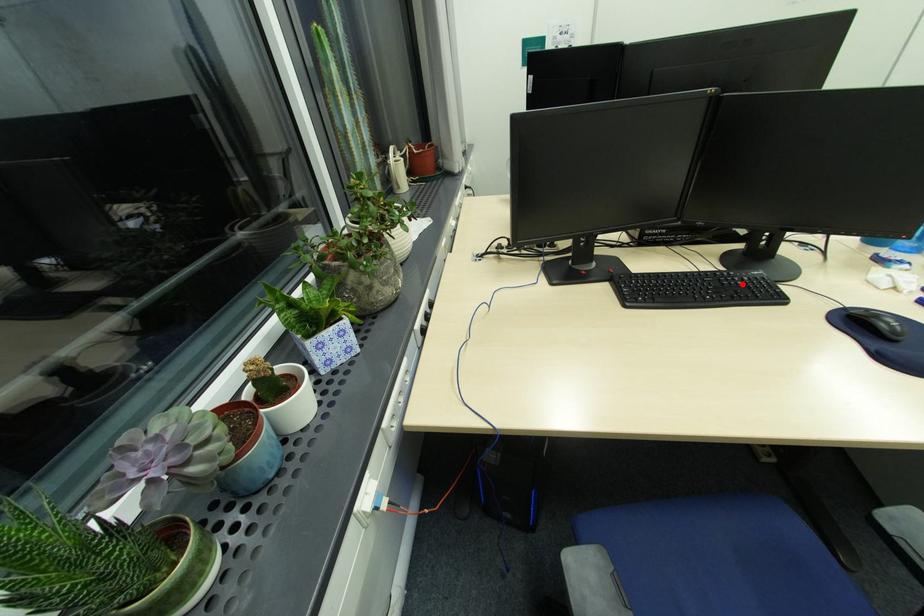
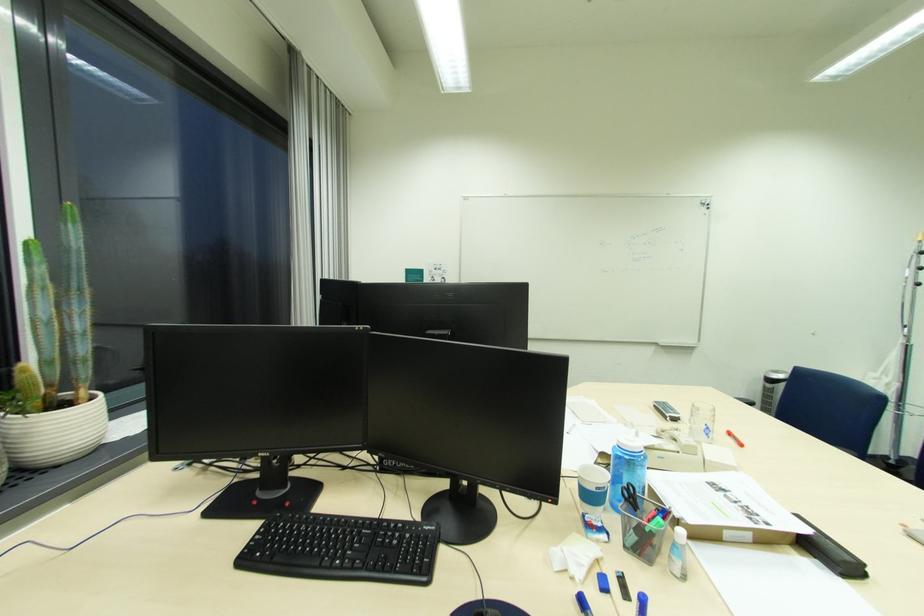
Find the pixel in the second image that matches the highlighted location in the first image.

(396, 541)